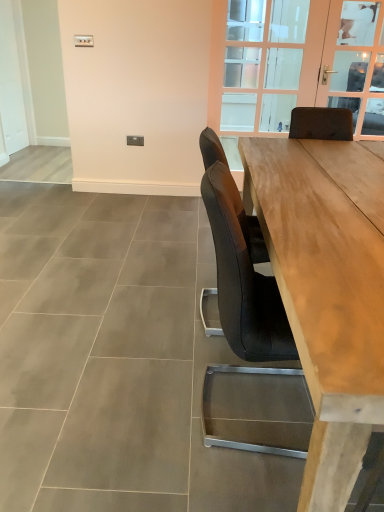
Question: Relative to natural wood table at center, is clear glass door at upper right in front or behind?

Choices:
 (A) front
 (B) behind

Answer: (B)

Question: From the image's perspective, is clear glass door at upper right above or below natural wood table at center?

Choices:
 (A) below
 (B) above

Answer: (B)

Question: Estimate the real-world distances between objects in this image. Which object is closer to the clear glass door at upper center?

Choices:
 (A) white matte door at left
 (B) natural wood table at center
 (C) clear glass door at upper right

Answer: (C)

Question: Which is nearer to the clear glass door at upper right?

Choices:
 (A) clear glass door at upper center
 (B) natural wood table at center
 (C) white matte door at left

Answer: (A)